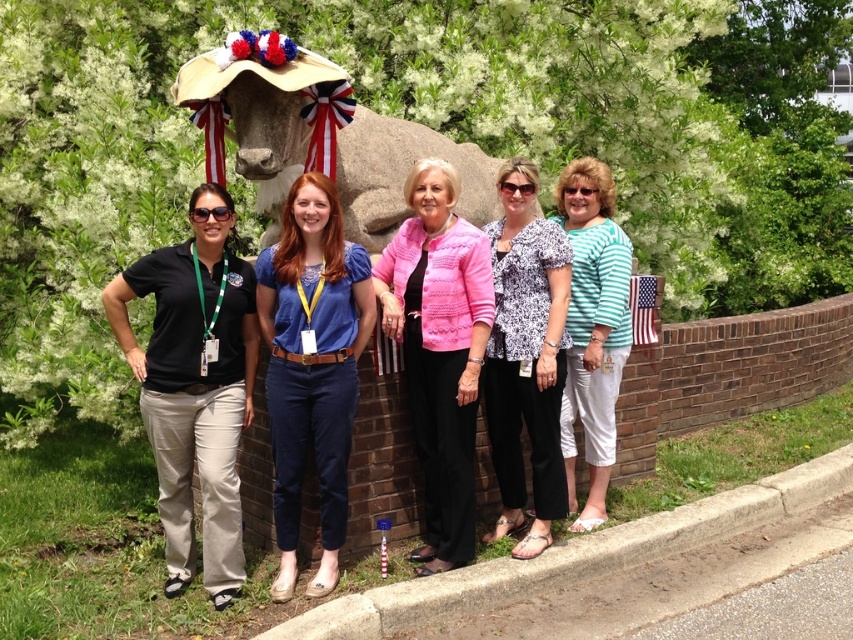
What is the exact location of the blue denim pants at center in the image?

The blue denim pants at center is located at point (312,365).

You are a photographer trying to capture a clear shot of the pink textured sweater at center and the american flag at center. Which object should you zoom in on to ensure it fills the frame more effectively?

The pink textured sweater at center is bigger than the american flag at center, so zooming in on the pink textured sweater at center would fill the frame more effectively.